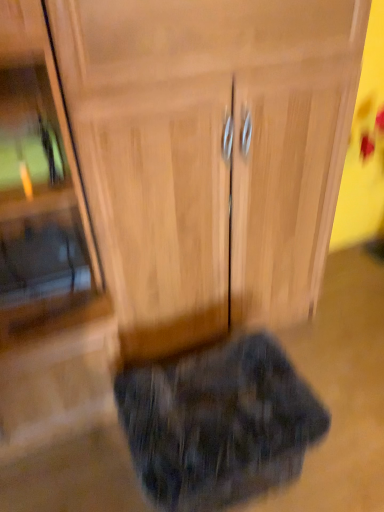
Find the location of a particular element. The width and height of the screenshot is (384, 512). wooden cabinet at center is located at coordinates (209, 154).

Describe the element at coordinates (209, 154) in the screenshot. I see `wooden cabinet at center` at that location.

Locate an element on the screen. The image size is (384, 512). fluffy dark gray cat at lower center is located at coordinates (218, 424).

Is fluffy dark gray cat at lower center thinner than wooden cabinet at center?

Correct, the width of fluffy dark gray cat at lower center is less than that of wooden cabinet at center.

Is fluffy dark gray cat at lower center smaller than wooden cabinet at center?

Indeed, fluffy dark gray cat at lower center has a smaller size compared to wooden cabinet at center.

Is point (185, 484) positioned in front of point (320, 55)?

Yes, point (185, 484) is closer to viewer.

From the image's perspective, is wooden cabinet at center on top of wooden cabinet at center?

Actually, wooden cabinet at center appears below wooden cabinet at center in the image.

Between wooden cabinet at center and wooden cabinet at center, which one has less height?

wooden cabinet at center.

Considering the sizes of objects wooden cabinet at center and wooden cabinet at center in the image provided, who is wider, wooden cabinet at center or wooden cabinet at center?

With larger width is wooden cabinet at center.

Considering the sizes of wooden cabinet at center and wooden cabinet at center in the image, is wooden cabinet at center bigger or smaller than wooden cabinet at center?

In the image, wooden cabinet at center appears to be smaller than wooden cabinet at center.

Find the location of `animal on the right of wooden cabinet at center`. animal on the right of wooden cabinet at center is located at coordinates (218, 424).

Which of these two, wooden cabinet at center or fluffy dark gray cat at lower center, is wider?

With larger width is wooden cabinet at center.

Is wooden cabinet at center to the left or to the right of fluffy dark gray cat at lower center in the image?

wooden cabinet at center is to the left of fluffy dark gray cat at lower center.

From a real-world perspective, is wooden cabinet at center positioned under fluffy dark gray cat at lower center based on gravity?

No, from a real-world perspective, wooden cabinet at center is not beneath fluffy dark gray cat at lower center.

Considering the sizes of wooden cabinet at center and wooden cabinet at center in the image, is wooden cabinet at center taller or shorter than wooden cabinet at center?

Clearly, wooden cabinet at center is shorter compared to wooden cabinet at center.

Is wooden cabinet at center located outside wooden cabinet at center?

Yes, wooden cabinet at center is located beyond the bounds of wooden cabinet at center.

Is wooden cabinet at center closer to camera compared to wooden cabinet at center?

No.

Does point (182, 170) lie in front of point (5, 10)?

No, (182, 170) is further to viewer.

From a real-world perspective, is fluffy dark gray cat at lower center physically located above or below wooden cabinet at center?

From a real-world perspective, fluffy dark gray cat at lower center is physically below wooden cabinet at center.

From the image's perspective, which object appears higher, fluffy dark gray cat at lower center or wooden cabinet at center?

wooden cabinet at center appears higher in the image.

Is fluffy dark gray cat at lower center bigger than wooden cabinet at center?

Incorrect, fluffy dark gray cat at lower center is not larger than wooden cabinet at center.

Is fluffy dark gray cat at lower center situated inside wooden cabinet at center or outside?

fluffy dark gray cat at lower center is spatially situated outside wooden cabinet at center.

Is the depth of wooden cabinet at center less than that of fluffy dark gray cat at lower center?

That is True.

Who is taller, wooden cabinet at center or fluffy dark gray cat at lower center?

Standing taller between the two is wooden cabinet at center.

At what (x,y) coordinates should I click in order to perform the action: click on animal located underneath the wooden cabinet at center (from a real-world perspective). Please return your answer as a coordinate pair (x, y). The width and height of the screenshot is (384, 512). Looking at the image, I should click on (218, 424).

Where is `side cabinet in front of the wooden cabinet at center`? Image resolution: width=384 pixels, height=512 pixels. side cabinet in front of the wooden cabinet at center is located at coordinates (45, 253).

Considering their positions, is wooden cabinet at center positioned further to wooden cabinet at center than fluffy dark gray cat at lower center?

Based on the image, fluffy dark gray cat at lower center appears to be further to wooden cabinet at center.

Based on their spatial positions, is wooden cabinet at center or wooden cabinet at center further from fluffy dark gray cat at lower center?

wooden cabinet at center lies further to fluffy dark gray cat at lower center than the other object.

Considering their positions, is wooden cabinet at center positioned closer to wooden cabinet at center than fluffy dark gray cat at lower center?

wooden cabinet at center.

When comparing their distances from wooden cabinet at center, does fluffy dark gray cat at lower center or wooden cabinet at center seem closer?

The object closer to wooden cabinet at center is wooden cabinet at center.

Looking at the image, which one is located further to fluffy dark gray cat at lower center, wooden cabinet at center or wooden cabinet at center?

Among the two, wooden cabinet at center is located further to fluffy dark gray cat at lower center.

Estimate the real-world distances between objects in this image. Which object is closer to wooden cabinet at center, fluffy dark gray cat at lower center or wooden cabinet at center?

wooden cabinet at center lies closer to wooden cabinet at center than the other object.

At what (x,y) coordinates should I click in order to perform the action: click on side cabinet between wooden cabinet at center and fluffy dark gray cat at lower center in the vertical direction. Please return your answer as a coordinate pair (x, y). This screenshot has width=384, height=512. Looking at the image, I should click on (45, 253).